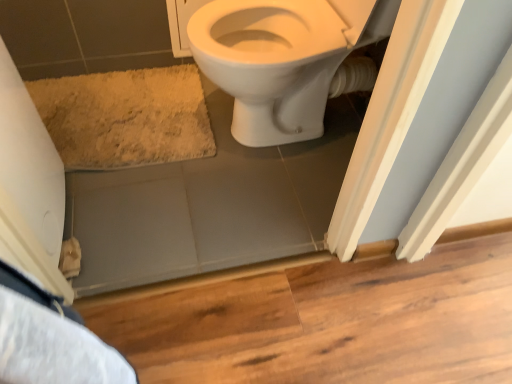
Question: From a real-world perspective, is beige shaggy bath mat at lower left under white glossy toilet at upper center?

Choices:
 (A) yes
 (B) no

Answer: (A)

Question: Is beige shaggy bath mat at lower left to the right of white glossy toilet at upper center from the viewer's perspective?

Choices:
 (A) yes
 (B) no

Answer: (B)

Question: Considering the relative sizes of beige shaggy bath mat at lower left and white glossy toilet at upper center in the image provided, is beige shaggy bath mat at lower left taller than white glossy toilet at upper center?

Choices:
 (A) no
 (B) yes

Answer: (A)

Question: Does beige shaggy bath mat at lower left lie in front of white glossy toilet at upper center?

Choices:
 (A) yes
 (B) no

Answer: (B)

Question: Can you confirm if beige shaggy bath mat at lower left is shorter than white glossy toilet at upper center?

Choices:
 (A) yes
 (B) no

Answer: (A)

Question: Does beige shaggy bath mat at lower left have a larger size compared to white glossy toilet at upper center?

Choices:
 (A) no
 (B) yes

Answer: (A)

Question: Is white glossy toilet at upper center positioned in front of beige shaggy bath mat at lower left?

Choices:
 (A) yes
 (B) no

Answer: (A)

Question: Is white glossy toilet at upper center at the left side of beige shaggy bath mat at lower left?

Choices:
 (A) yes
 (B) no

Answer: (B)

Question: From the image's perspective, is white glossy toilet at upper center above beige shaggy bath mat at lower left?

Choices:
 (A) yes
 (B) no

Answer: (A)

Question: Is white glossy toilet at upper center taller than beige shaggy bath mat at lower left?

Choices:
 (A) yes
 (B) no

Answer: (A)

Question: Is white glossy toilet at upper center aimed at beige shaggy bath mat at lower left?

Choices:
 (A) no
 (B) yes

Answer: (B)

Question: Would you say beige shaggy bath mat at lower left is part of white glossy toilet at upper center's contents?

Choices:
 (A) yes
 (B) no

Answer: (B)

Question: Relative to white glossy toilet at upper center, is beige shaggy bath mat at lower left in front or behind?

Choices:
 (A) front
 (B) behind

Answer: (B)